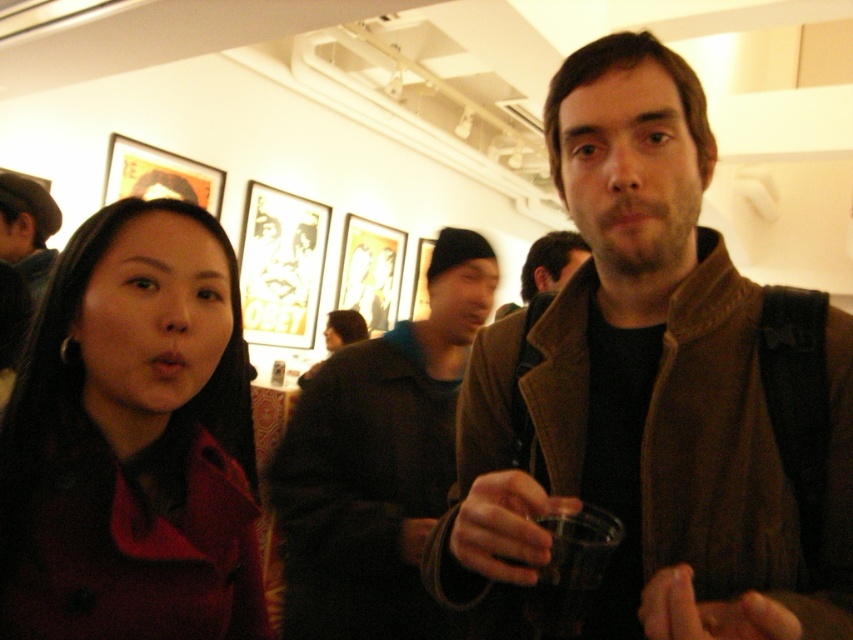
You are standing in the gallery and want to know how far the point at coordinates (778, 632) is from you. Can you determine the distance?

The distance of point (778, 632) from viewer is 18.92 inches.

You are a photographer standing at the camera position. You want to take a closeup shot of the brown leather jacket at center. Is the jacket within your camera lens range of 50 centimeters?

The distance between the brown leather jacket at center and the camera is 46.79 centimeters, which is within the 50 centimeter range. Therefore, the jacket is within the camera lens range.